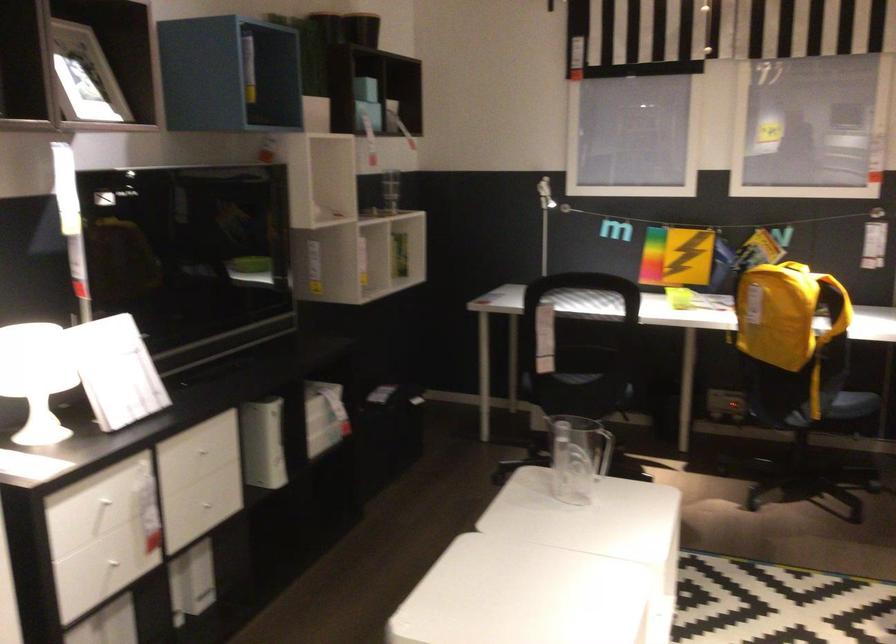
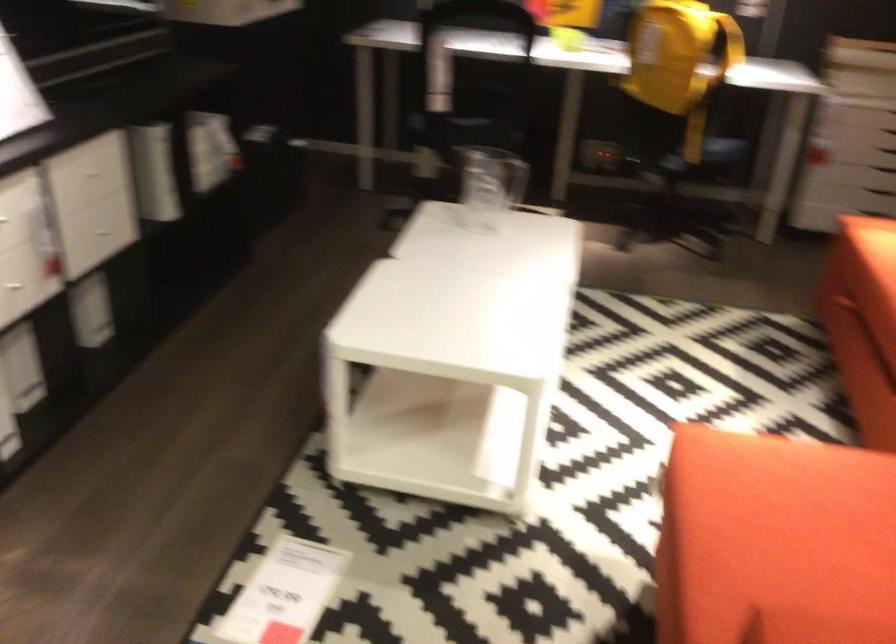
Question: The first image is from the beginning of the video and the second image is from the end. How did the camera likely rotate when shooting the video?

Choices:
 (A) Left
 (B) Right
 (C) Up
 (D) Down

Answer: (D)